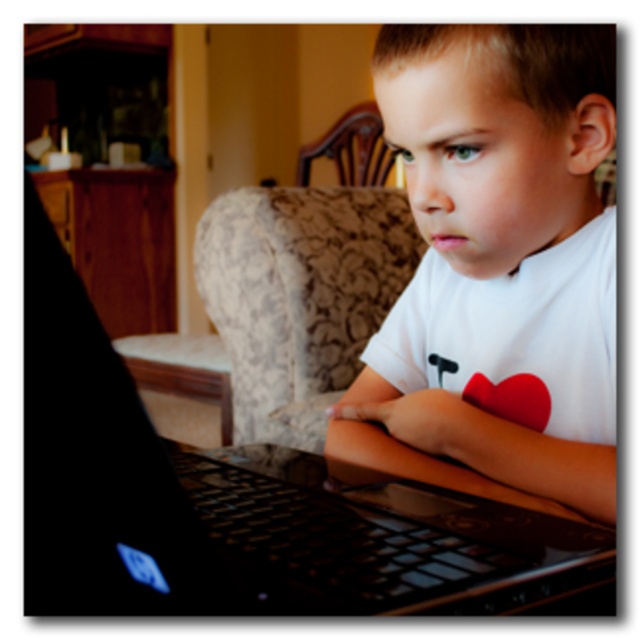
Which is below, white matte shirt at center or wooden chair at upper center?

white matte shirt at center is lower down.

Is point (403, 33) positioned behind point (372, 104)?

No, it is in front of (372, 104).

The width and height of the screenshot is (640, 640). In order to click on white matte shirt at center in this screenshot , I will do `click(497, 134)`.

Does point (353, 154) come farther from viewer compared to point (547, 401)?

Yes.

Does wooden chair at upper center have a greater width compared to red matte heart at lower center?

Yes.

Is point (374, 116) less distant than point (484, 380)?

No, (374, 116) is further to viewer.

The image size is (640, 640). I want to click on wooden chair at upper center, so click(349, 148).

Which is more to the left, black glossy laptop at center or white matte shirt at center?

Positioned to the left is black glossy laptop at center.

Is point (560, 580) in front of point (468, 412)?

Yes, point (560, 580) is closer to viewer.

Is point (387, 518) farther from viewer compared to point (417, 180)?

No, (387, 518) is in front of (417, 180).

Find the location of `black glossy laptop at center`. black glossy laptop at center is located at coordinates (234, 504).